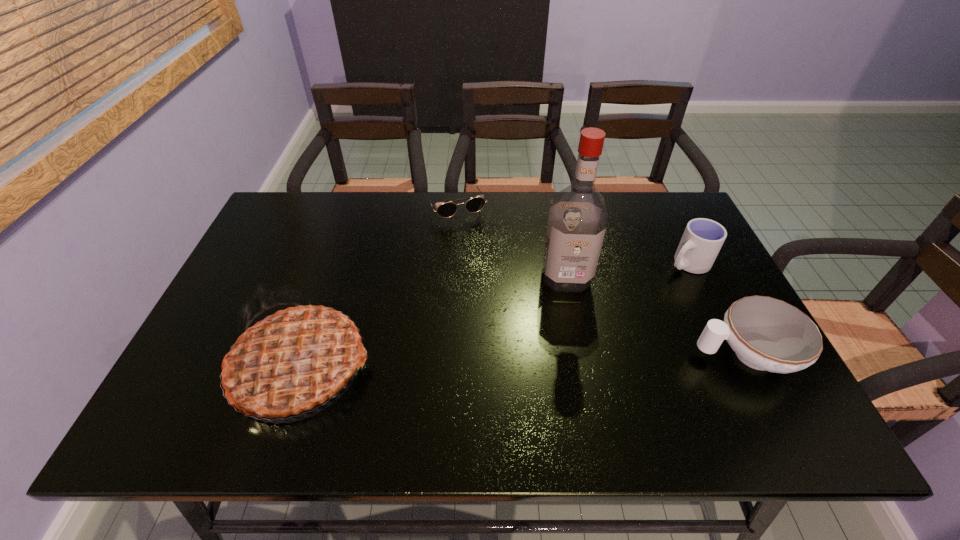
This screenshot has height=540, width=960. Find the location of `vacant space at the near edge of the desktop`. vacant space at the near edge of the desktop is located at coordinates (543, 394).

This screenshot has width=960, height=540. Identify the location of free region at the left edge of the desktop. (251, 275).

This screenshot has width=960, height=540. In the image, there is a desktop. Identify the location of free space at the right edge. (672, 261).

The width and height of the screenshot is (960, 540). I want to click on free space at the far left corner of the desktop, so click(x=296, y=196).

The image size is (960, 540). In order to click on free space at the near left corner in this screenshot , I will do `click(191, 365)`.

The width and height of the screenshot is (960, 540). Identify the location of free spot between the tallest object and the cup. (627, 270).

The height and width of the screenshot is (540, 960). Identify the location of free space that is in between the leftmost object and the farthest object. (378, 288).

The width and height of the screenshot is (960, 540). I want to click on free area in between the third object from right to left and the fourth tallest object, so click(656, 315).

I want to click on empty location between the second tallest object and the tallest object, so click(434, 322).

Find the location of a particular element. free space between the liquor and the pie is located at coordinates (x=434, y=322).